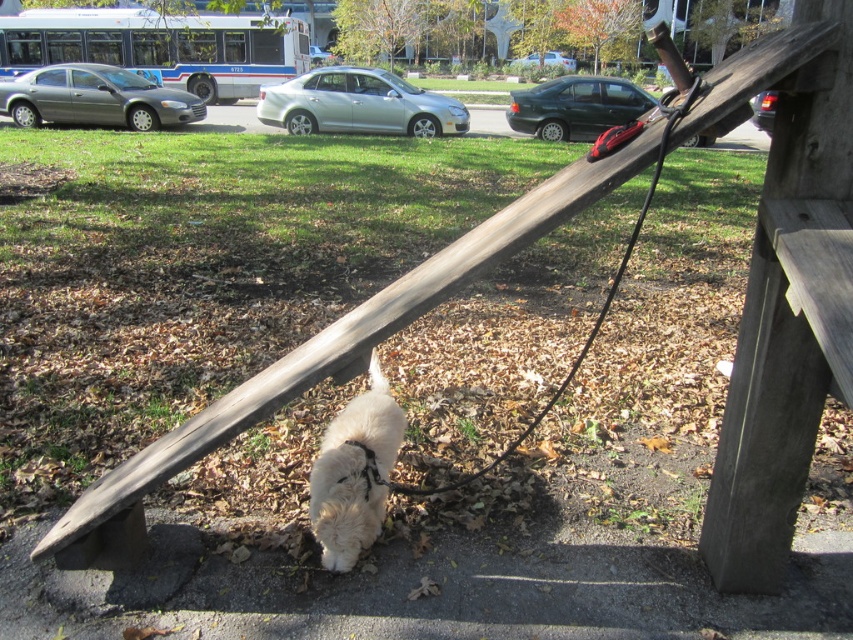
Is white fluffy dog at lower center closer to camera compared to black rubber leash at lower center?

No, white fluffy dog at lower center is further to the viewer.

Which is more to the right, white fluffy dog at lower center or black rubber leash at lower center?

Positioned to the right is black rubber leash at lower center.

The width and height of the screenshot is (853, 640). I want to click on white fluffy dog at lower center, so click(x=354, y=472).